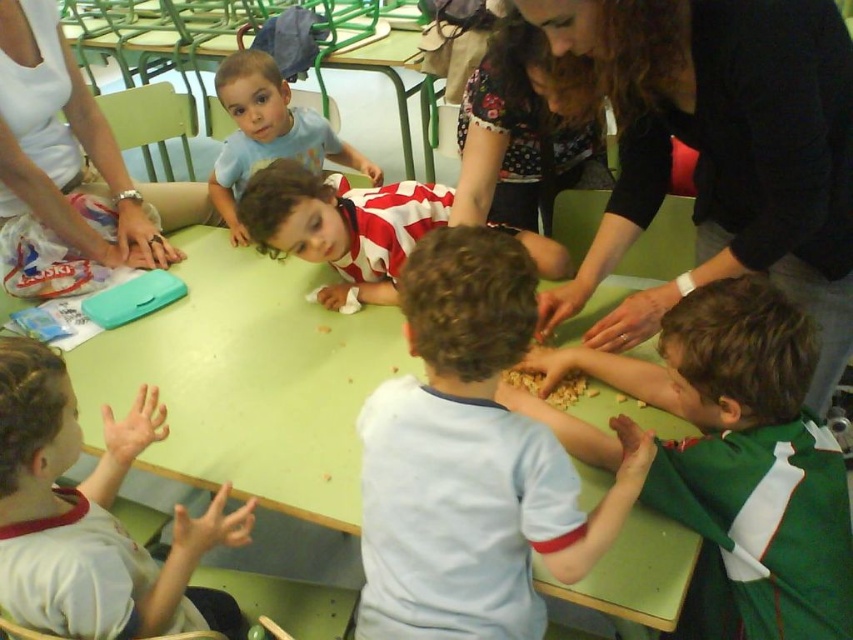
Is point (831, 93) positioned in front of point (170, 250)?

Yes, it is.

What do you see at coordinates (721, 150) in the screenshot? The height and width of the screenshot is (640, 853). I see `dark blue sweater at upper right` at bounding box center [721, 150].

Locate an element on the screen. This screenshot has height=640, width=853. dark blue sweater at upper right is located at coordinates (721, 150).

Between dark blue sweater at upper right and striped jersey at center, which one has less height?

striped jersey at center

Which is in front, point (654, 205) or point (264, 228)?

Point (654, 205) is more forward.

Where is `dark blue sweater at upper right`? Image resolution: width=853 pixels, height=640 pixels. dark blue sweater at upper right is located at coordinates (721, 150).

This screenshot has height=640, width=853. In order to click on dark blue sweater at upper right in this screenshot , I will do [x=721, y=150].

Is point (653, 604) closer to camera compared to point (320, 259)?

Yes.

Can you confirm if green matte table at center is thinner than striped jersey at center?

In fact, green matte table at center might be wider than striped jersey at center.

Is point (213, 371) less distant than point (376, 236)?

Yes, point (213, 371) is in front of point (376, 236).

This screenshot has height=640, width=853. I want to click on green matte table at center, so click(x=248, y=381).